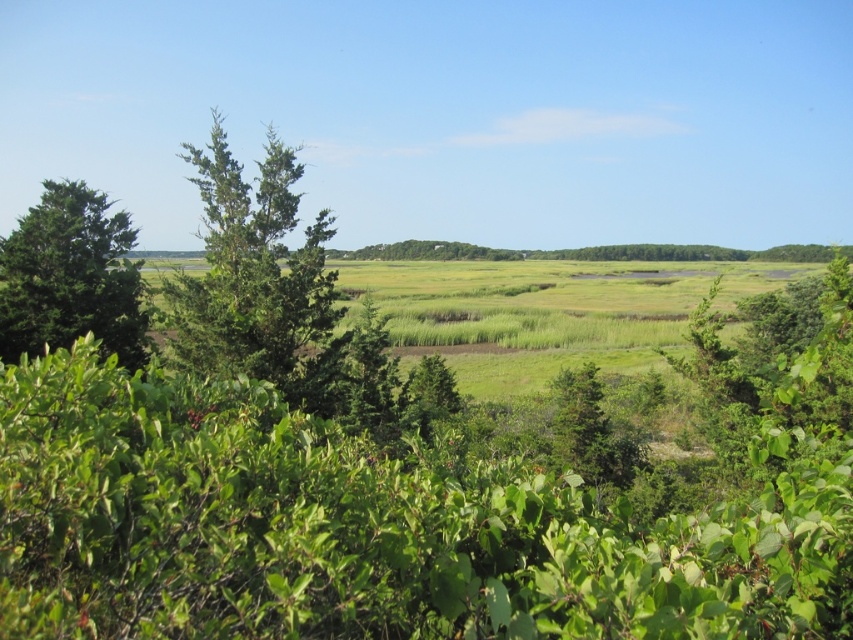
Question: Which point is closer to the camera taking this photo?

Choices:
 (A) click(67, 330)
 (B) click(257, 321)

Answer: (B)

Question: Is green textured tree at left behind green leafy tree at left?

Choices:
 (A) no
 (B) yes

Answer: (A)

Question: Can you confirm if green textured tree at left is positioned to the left of green leafy tree at left?

Choices:
 (A) yes
 (B) no

Answer: (B)

Question: Among these points, which one is nearest to the camera?

Choices:
 (A) (16, 312)
 (B) (267, 221)

Answer: (A)

Question: Is green textured tree at left bigger than green leafy tree at left?

Choices:
 (A) no
 (B) yes

Answer: (B)

Question: Which point is closer to the camera?

Choices:
 (A) (53, 285)
 (B) (251, 362)

Answer: (B)